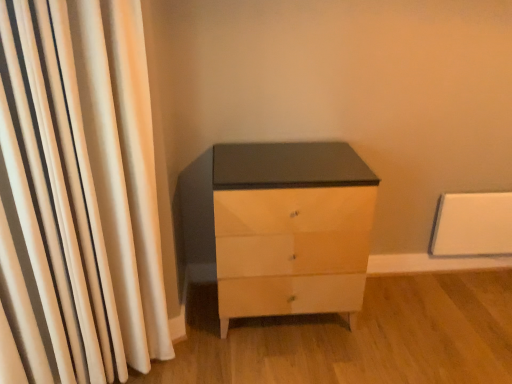
Identify the location of free space to the right of white fabric curtain at left. (205, 363).